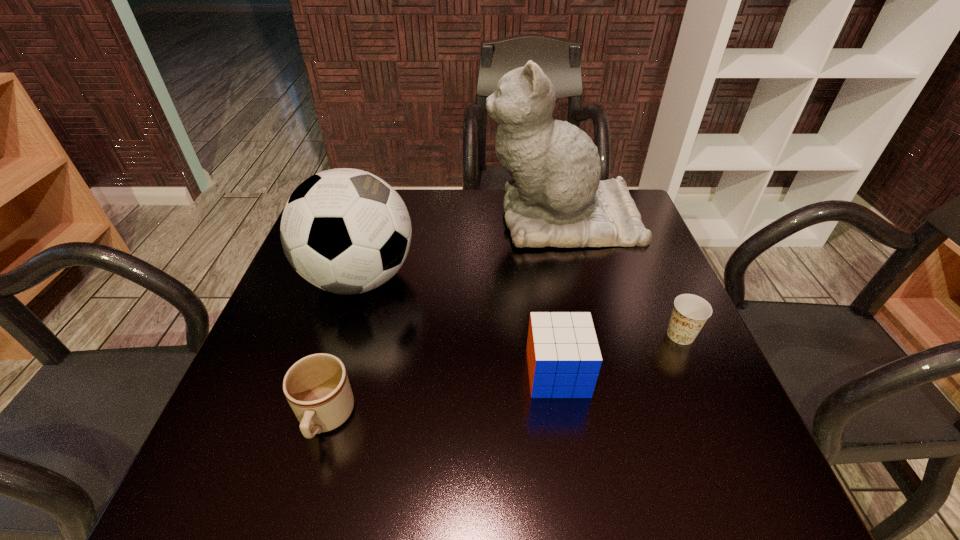
You are a GUI agent. You are given a task and a screenshot of the screen. Output one action in this format:
    pyautogui.click(x=<x>, y=<y>)
    Task: Click on the cat
    The height and width of the screenshot is (540, 960).
    Given the screenshot: What is the action you would take?
    pyautogui.click(x=555, y=197)

At what (x,y) coordinates should I click in order to perform the action: click on the fourth shortest object. Please return your answer as a coordinate pair (x, y). The image size is (960, 540). Looking at the image, I should click on (346, 231).

The width and height of the screenshot is (960, 540). In order to click on cube in this screenshot , I will do `click(563, 355)`.

This screenshot has width=960, height=540. Identify the location of mug. (317, 388).

Locate an element on the screen. This screenshot has width=960, height=540. the third farthest object is located at coordinates (690, 312).

Where is `the shortest object`? the shortest object is located at coordinates (690, 312).

This screenshot has width=960, height=540. Find the location of `vacant region located 0.200m on the front-facing side of the cat`. vacant region located 0.200m on the front-facing side of the cat is located at coordinates (414, 218).

Locate an element on the screen. vacant space situated 0.100m on the front-facing side of the cat is located at coordinates (449, 218).

Find the location of `free region located on the front-facing side of the cat`. free region located on the front-facing side of the cat is located at coordinates pyautogui.click(x=353, y=218).

Image resolution: width=960 pixels, height=540 pixels. I want to click on free space located on the main logo of the soccer ball, so click(x=489, y=278).